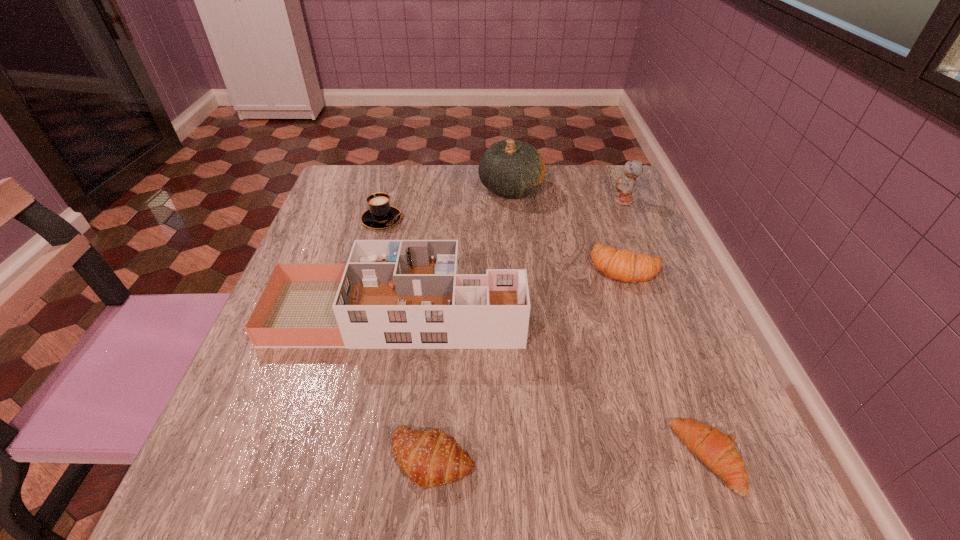
What are the coordinates of `free region located 0.370m on the front-facing side of the teddy bear` in the screenshot? It's located at (468, 201).

You are a GUI agent. You are given a task and a screenshot of the screen. Output one action in this format:
    pyautogui.click(x=<x>, y=<y>)
    Task: Click on the vacant space located on the front-facing side of the teddy bear
    The height and width of the screenshot is (540, 960).
    Given the screenshot: What is the action you would take?
    pyautogui.click(x=542, y=201)

The image size is (960, 540). What are the coordinates of `blank area located 0.290m at the front door of the dollhouse` in the screenshot? It's located at (674, 313).

Find the location of a particular element. vacant point located 0.190m on the front of the farthest crescent roll is located at coordinates (661, 366).

Identify the location of free space located on the front of the cappuccino. (364, 285).

Where is `vacant position located 0.100m on the back of the leftmost crescent roll`? This screenshot has height=540, width=960. vacant position located 0.100m on the back of the leftmost crescent roll is located at coordinates (440, 373).

Identify the location of vacant space located on the left of the shortest object. Image resolution: width=960 pixels, height=540 pixels. (428, 457).

Find the location of `gourd located at the far edge`. gourd located at the far edge is located at coordinates (509, 168).

Where is `teddy bear that is positioned at the far edge`? teddy bear that is positioned at the far edge is located at coordinates (625, 186).

The height and width of the screenshot is (540, 960). What are the coordinates of `cappuccino at the far edge` in the screenshot? It's located at (380, 214).